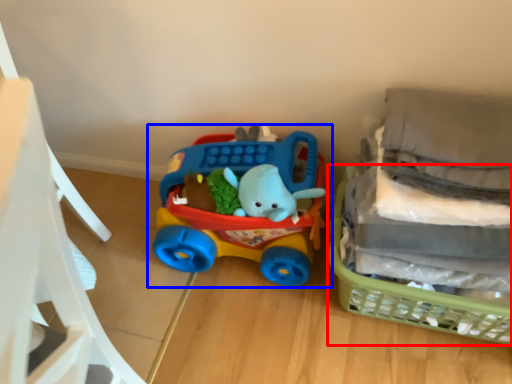
Question: Which object is further to the camera taking this photo, basket (highlighted by a red box) or toy (highlighted by a blue box)?

Choices:
 (A) basket
 (B) toy

Answer: (B)